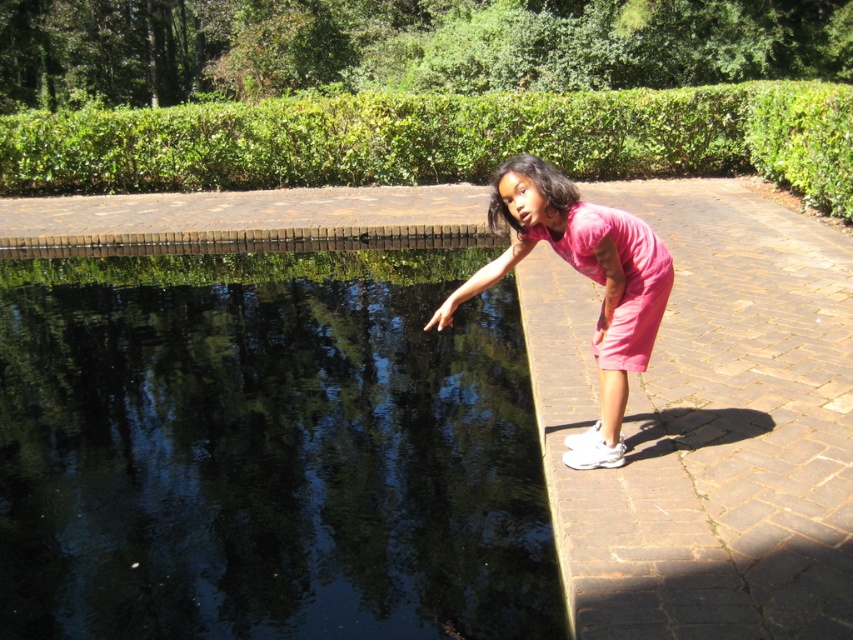
The girl is wearing two pink dresses. The pink fabric dress at right and the pink matte dress at right. Which one is closer to the ground?

The pink fabric dress at right is closer to the ground because it is positioned below the pink matte dress at right.

From the picture: You are a photographer trying to capture the reflection of the black smooth water at center in your shot. Since the pink fabric dress at right might block the view, can you determine which object is wider so you can adjust your camera angle accordingly?

The black smooth water at center has a lesser width compared to pink fabric dress at right, so the pink fabric dress at right is wider and might block the reflection. Adjust the camera angle to avoid the dress.